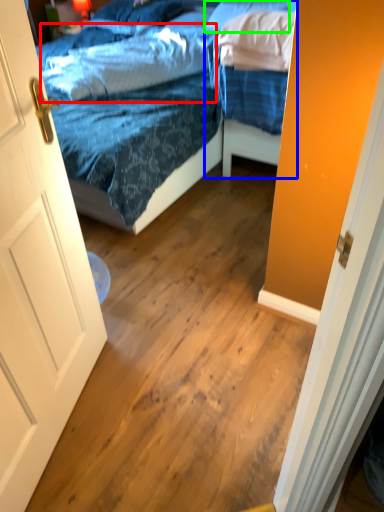
Question: Based on their relative distances, which object is farther from pillow (highlighted by a red box)? Choose from bed (highlighted by a blue box) and pillow (highlighted by a green box).

Choices:
 (A) bed
 (B) pillow

Answer: (B)